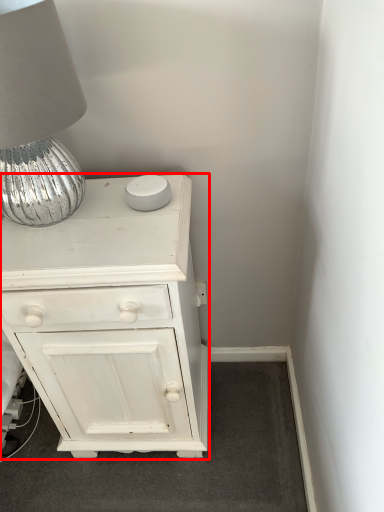
Question: Observing the image, what is the correct spatial positioning of chest of drawers (annotated by the red box) in reference to table lamp?

Choices:
 (A) left
 (B) right

Answer: (B)